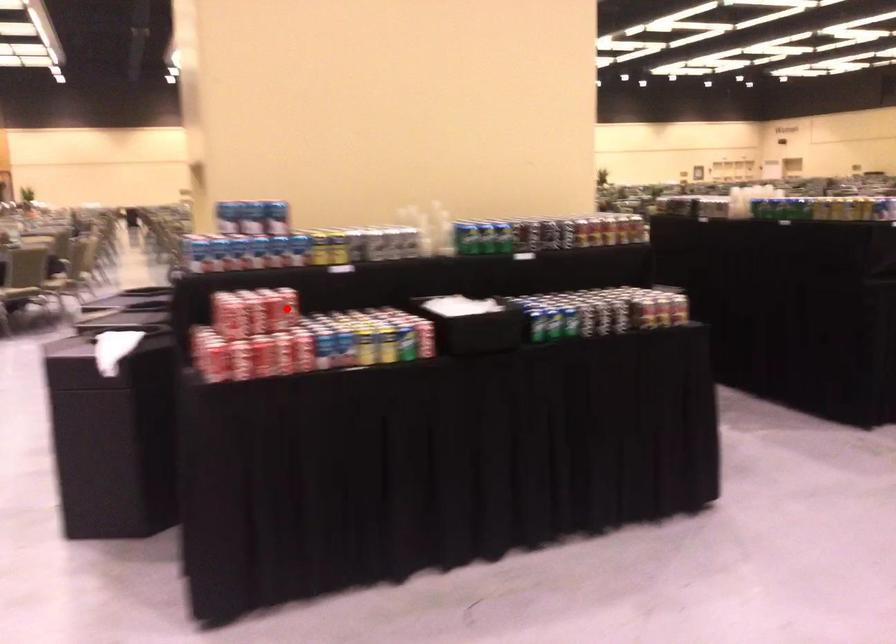
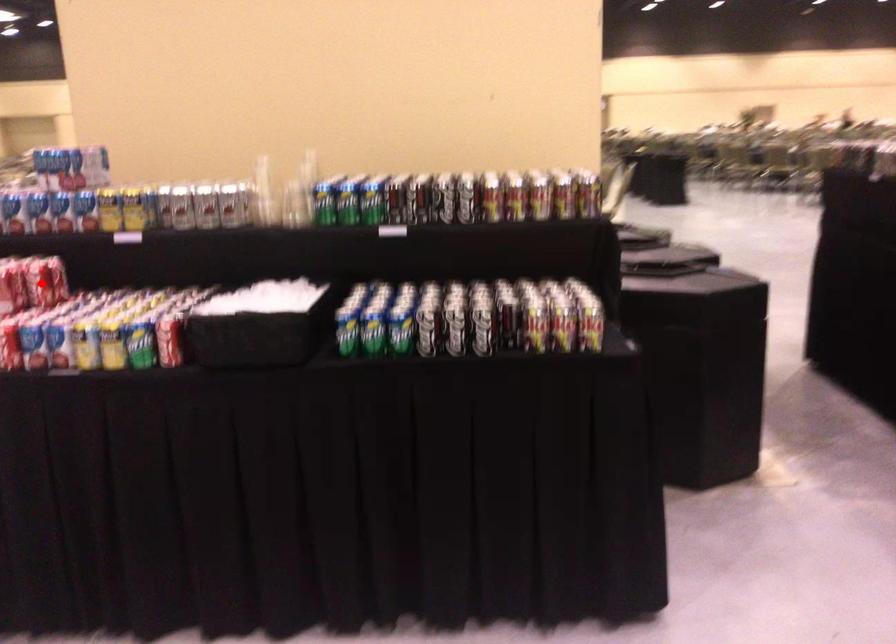
I am providing you with two images of the same scene from different viewpoints. A red point is marked on the first image and another point is marked on the second image. Is the marked point in image1 the same physical position as the marked point in image2?

Yes